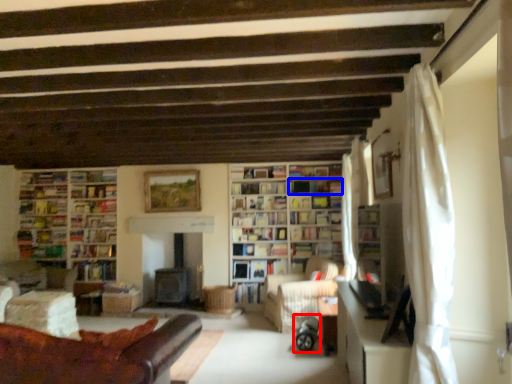
Question: Which object appears farthest to the camera in this image, baby carriage (highlighted by a red box) or shelf (highlighted by a blue box)?

Choices:
 (A) baby carriage
 (B) shelf

Answer: (B)